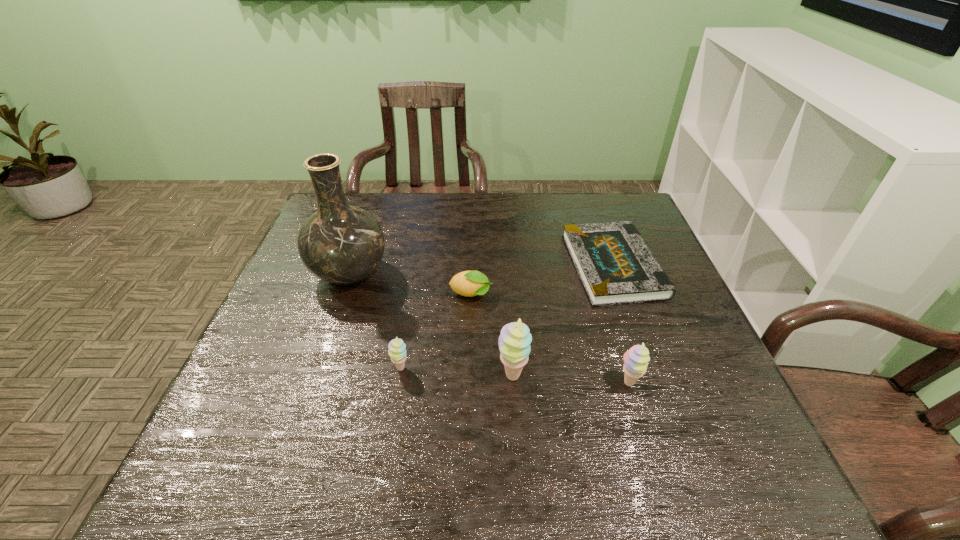
With all sherberts evenly spaced, where should an extra sherbert be placed on the left to continue the pattern? Please point out a vacant space. Please provide its 2D coordinates. Your answer should be formatted as a tuple, i.e. [(x, y)], where the tuple contains the x and y coordinates of a point satisfying the conditions above.

[(292, 361)]